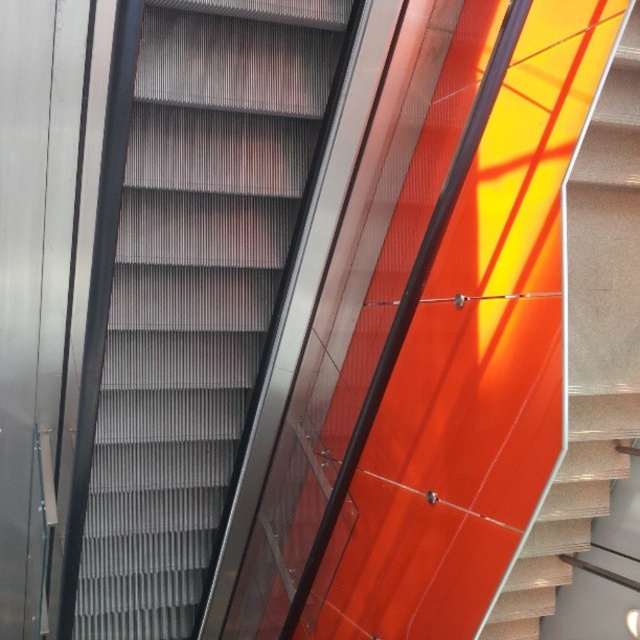
Question: Which point is closer to the camera?

Choices:
 (A) metallic gray escalator steps at center
 (B) matte orange wall at right

Answer: (B)

Question: Which object is closer to the camera taking this photo?

Choices:
 (A) metallic gray escalator steps at center
 (B) matte orange wall at right

Answer: (B)

Question: Is metallic gray escalator steps at center bigger than matte orange wall at right?

Choices:
 (A) no
 (B) yes

Answer: (B)

Question: Does metallic gray escalator steps at center appear under matte orange wall at right?

Choices:
 (A) no
 (B) yes

Answer: (A)

Question: Does metallic gray escalator steps at center have a lesser width compared to matte orange wall at right?

Choices:
 (A) no
 (B) yes

Answer: (A)